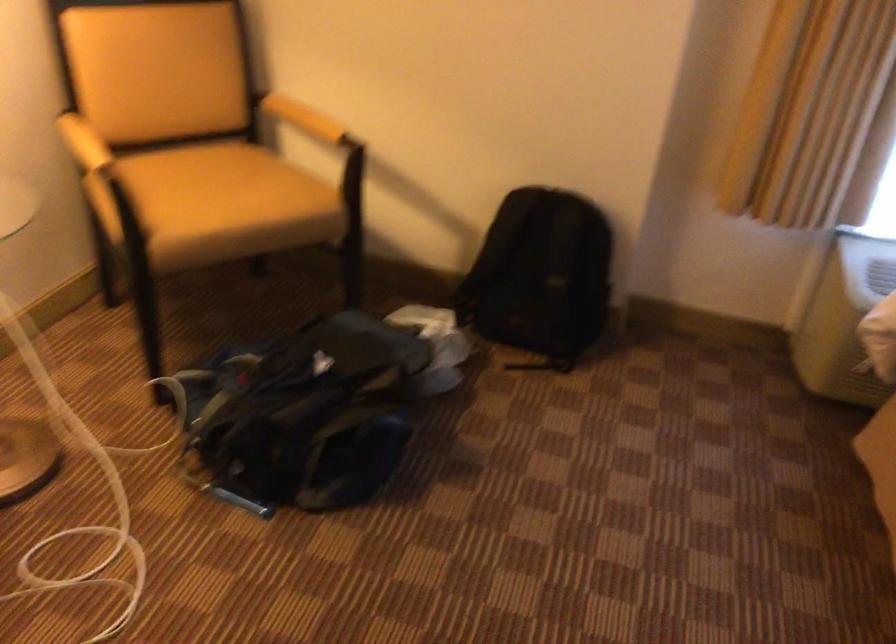
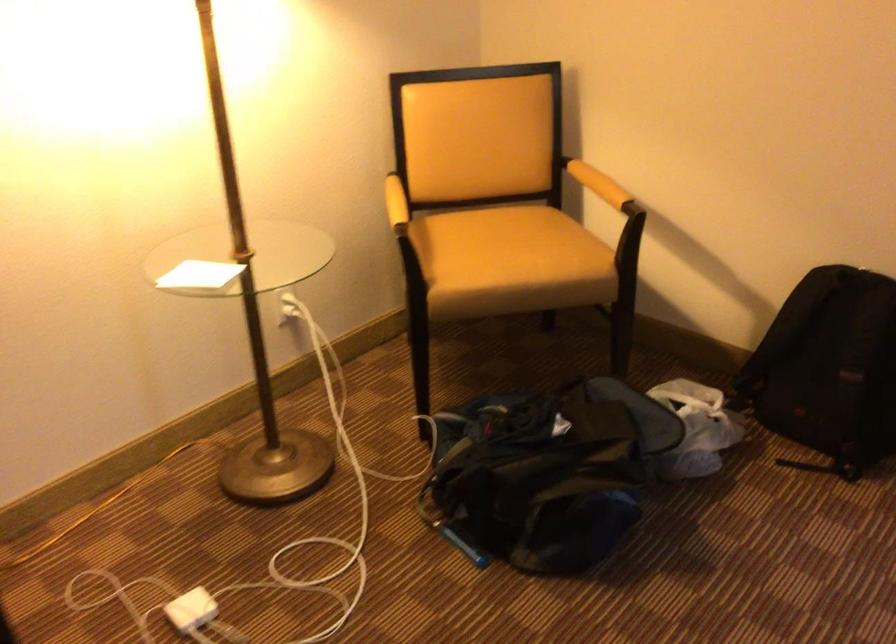
Question: The first image is from the beginning of the video and the second image is from the end. How did the camera likely rotate when shooting the video?

Choices:
 (A) Left
 (B) Right
 (C) Up
 (D) Down

Answer: (A)